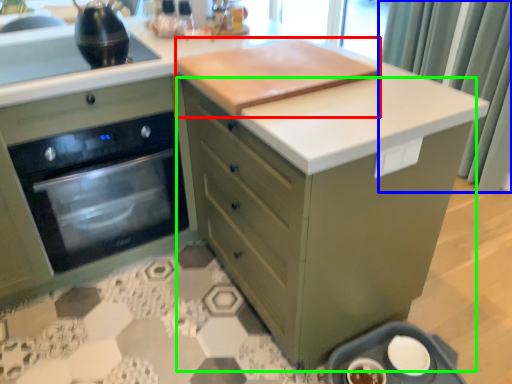
Question: Which object is positioned closest to wide (highlighted by a red box)? Select from curtain (highlighted by a blue box) and cabinetry (highlighted by a green box).

Choices:
 (A) curtain
 (B) cabinetry

Answer: (B)